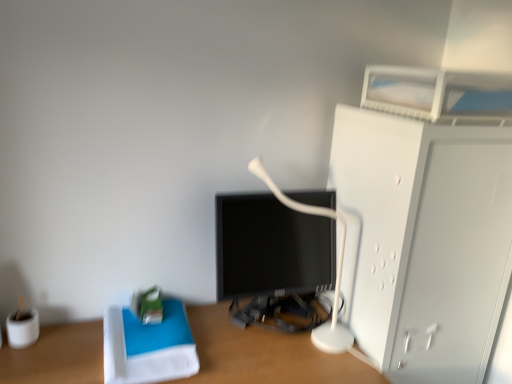
Image resolution: width=512 pixels, height=384 pixels. What are the coordinates of `free point below white plastic table lamp at center (from a real-world perspective)` in the screenshot? It's located at (298, 354).